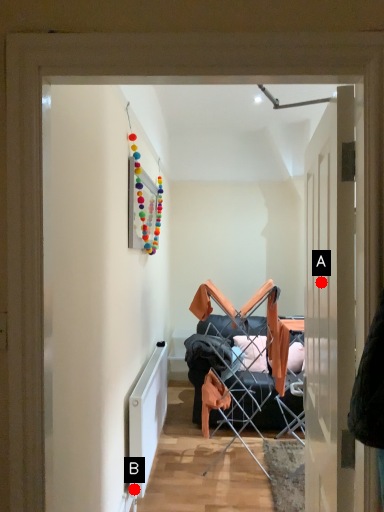
Question: Two points are circled on the image, labeled by A and B beside each circle. Which point is closer to the camera?

Choices:
 (A) A is closer
 (B) B is closer

Answer: (A)